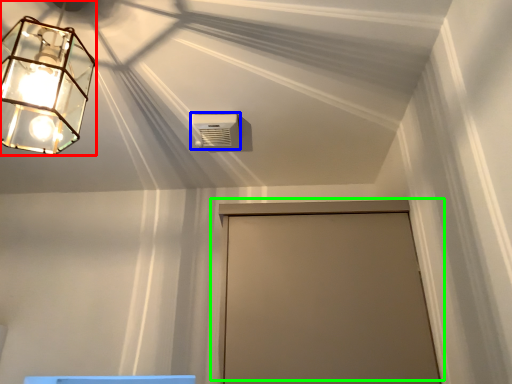
Question: Estimate the real-world distances between objects in this image. Which object is farther from lamp (highlighted by a red box), air conditioning (highlighted by a blue box) or door (highlighted by a green box)?

Choices:
 (A) air conditioning
 (B) door

Answer: (B)